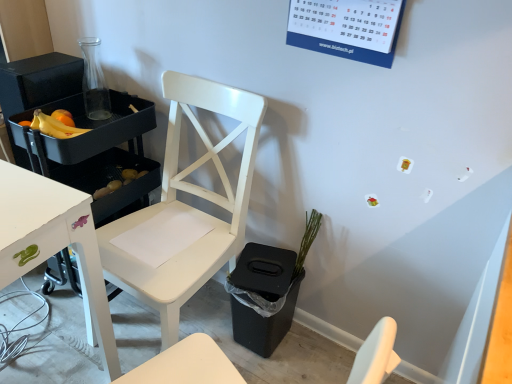
Find the location of `green matte plant at lower center`. green matte plant at lower center is located at coordinates (307, 240).

Locate an element on the screen. This screenshot has height=384, width=512. yellow matte potatoes at lower left is located at coordinates (119, 182).

Image resolution: width=512 pixels, height=384 pixels. What do you see at coordinates (119, 182) in the screenshot?
I see `yellow matte potatoes at lower left` at bounding box center [119, 182].

In order to click on white matte chair at center in this screenshot , I will do `click(189, 206)`.

This screenshot has width=512, height=384. Describe the element at coordinates (189, 206) in the screenshot. I see `white matte chair at center` at that location.

Describe the element at coordinates (267, 290) in the screenshot. I see `black plastic houseplant at lower right` at that location.

This screenshot has height=384, width=512. Find the location of `green matte plant at lower center`. green matte plant at lower center is located at coordinates (x=307, y=240).

Is yellow matte bananas at left turned away from white matte chair at center?

yellow matte bananas at left is not turned away from white matte chair at center.

From the image's perspective, which is below, yellow matte bananas at left or white matte chair at center?

white matte chair at center is shown below in the image.

Which object is positioned more to the left, yellow matte bananas at left or white matte chair at center?

From the viewer's perspective, yellow matte bananas at left appears more on the left side.

Can you see yellow matte bananas at left touching white matte chair at center?

No, yellow matte bananas at left is not in contact with white matte chair at center.

Locate an element on the screen. The image size is (512, 384). food lying above the white matte chair at center (from the image's perspective) is located at coordinates (119, 182).

Is yellow matte potatoes at lower left next to white matte chair at center and touching it?

No, yellow matte potatoes at lower left is not touching white matte chair at center.

How much distance is there between yellow matte potatoes at lower left and white matte chair at center?

The distance of yellow matte potatoes at lower left from white matte chair at center is 13.63 inches.

Between white matte chair at center and yellow matte potatoes at lower left, which one has smaller width?

→ With smaller width is yellow matte potatoes at lower left.

Is white matte chair at center in front of or behind yellow matte potatoes at lower left in the image?

In the image, white matte chair at center appears in front of yellow matte potatoes at lower left.

Is white matte chair at center completely or partially outside of yellow matte potatoes at lower left?

Yes, white matte chair at center is outside of yellow matte potatoes at lower left.

How different are the orientations of white matte chair at center and black plastic houseplant at lower right in degrees?

They differ by 0.000159 degrees in their facing directions.

Which is in front, white matte chair at center or black plastic houseplant at lower right?

white matte chair at center is more forward.

Consider the image. Is black plastic houseplant at lower right at the back of white matte chair at center?

white matte chair at center does not have its back to black plastic houseplant at lower right.

Considering the positions of points (55, 117) and (319, 216), is point (55, 117) farther from camera compared to point (319, 216)?

No, (55, 117) is in front of (319, 216).

Is yellow matte bananas at left with green matte plant at lower center?

No.

Who is shorter, yellow matte bananas at left or green matte plant at lower center?

With less height is yellow matte bananas at left.

From the image's perspective, is yellow matte bananas at left above green matte plant at lower center?

Yes, from the image's perspective, yellow matte bananas at left is on top of green matte plant at lower center.

Is green matte plant at lower center at the back of black plastic houseplant at lower right?

No.

Where is `houseplant on the left of green matte plant at lower center`? The width and height of the screenshot is (512, 384). houseplant on the left of green matte plant at lower center is located at coordinates (267, 290).

From the image's perspective, is black plastic houseplant at lower right positioned above or below green matte plant at lower center?

black plastic houseplant at lower right is below green matte plant at lower center.

Is black plastic houseplant at lower right in front of green matte plant at lower center?

Yes.

From a real-world perspective, which is physically below, green matte plant at lower center or yellow matte bananas at left?

green matte plant at lower center, from a real-world perspective.

How many degrees apart are the facing directions of green matte plant at lower center and yellow matte bananas at left?

green matte plant at lower center and yellow matte bananas at left are facing 29.2 degrees away from each other.

Which of these two, green matte plant at lower center or yellow matte bananas at left, stands taller?

green matte plant at lower center.

Considering the points (311, 218) and (59, 114), which point is in front, point (311, 218) or point (59, 114)?

Point (59, 114)

Find the location of a particular element. chair directly beneath the yellow matte bananas at left (from a real-world perspective) is located at coordinates (189, 206).

At what (x,y) coordinates should I click in order to perform the action: click on food on the left of the white matte chair at center. Please return your answer as a coordinate pair (x, y). The image size is (512, 384). Looking at the image, I should click on (119, 182).

Estimate the real-world distances between objects in this image. Which object is further from yellow matte potatoes at lower left, green matte plant at lower center or black plastic houseplant at lower right?

green matte plant at lower center is further to yellow matte potatoes at lower left.

When comparing their distances from white matte chair at center, does yellow matte potatoes at lower left or green matte plant at lower center seem closer?

yellow matte potatoes at lower left is closer to white matte chair at center.

When comparing their distances from yellow matte potatoes at lower left, does white matte chair at center or green matte plant at lower center seem closer?

Among the two, white matte chair at center is located nearer to yellow matte potatoes at lower left.

Considering their positions, is yellow matte potatoes at lower left positioned further to yellow matte bananas at left than black plastic houseplant at lower right?

black plastic houseplant at lower right is positioned further to the anchor yellow matte bananas at left.

Estimate the real-world distances between objects in this image. Which object is further from black plastic houseplant at lower right, yellow matte potatoes at lower left or green matte plant at lower center?

Among the two, yellow matte potatoes at lower left is located further to black plastic houseplant at lower right.

When comparing their distances from black plastic houseplant at lower right, does yellow matte bananas at left or green matte plant at lower center seem further?

yellow matte bananas at left lies further to black plastic houseplant at lower right than the other object.

Estimate the real-world distances between objects in this image. Which object is closer to yellow matte potatoes at lower left, white matte chair at center or black plastic houseplant at lower right?

Based on the image, white matte chair at center appears to be nearer to yellow matte potatoes at lower left.

Considering their positions, is yellow matte bananas at left positioned further to green matte plant at lower center than white matte chair at center?

Among the two, yellow matte bananas at left is located further to green matte plant at lower center.

Identify the location of houseplant positioned between white matte chair at center and yellow matte potatoes at lower left from near to far. (267, 290).

Where is `houseplant between yellow matte potatoes at lower left and green matte plant at lower center in the horizontal direction`? This screenshot has height=384, width=512. houseplant between yellow matte potatoes at lower left and green matte plant at lower center in the horizontal direction is located at coordinates (267, 290).

Where is `plant located between white matte chair at center and yellow matte potatoes at lower left in the depth direction`? plant located between white matte chair at center and yellow matte potatoes at lower left in the depth direction is located at coordinates (307, 240).

You are a GUI agent. You are given a task and a screenshot of the screen. Output one action in this format:
    pyautogui.click(x=<x>, y=<y>)
    Task: Click on the food located between yellow matte bananas at left and green matte plant at lower center in the left-right direction
    
    Given the screenshot: What is the action you would take?
    pyautogui.click(x=119, y=182)